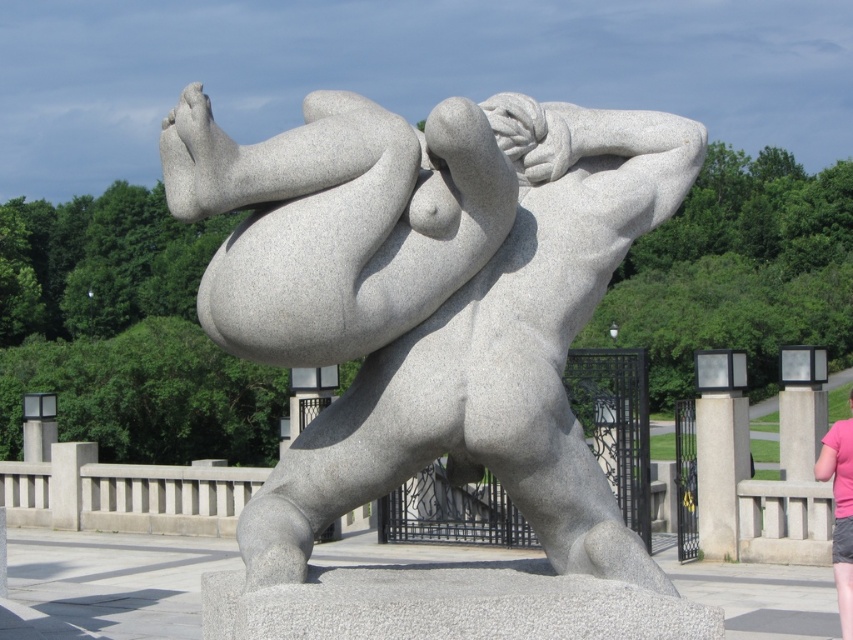
You are standing in a park and see the granite statue at center. If you want to take a photo of it from a distance that is exactly 25 feet away, would you need to move closer or farther away?

The granite statue at center is currently 30.09 feet away from you. To take a photo from exactly 25 feet away, you would need to move closer to the statue by approximately 5.09 feet.

You are a visitor at an art exhibition and see the granite statue at center and the pink fabric at lower right. According to the scene, which object is positioned to the right side?

The pink fabric at lower right is positioned to the right of the granite statue at center.

You are a photographer standing at the edge of the paved area. You want to take a photo of the granite statue at center and the pink fabric at lower right. Which object should you focus on first to ensure both are in sharp focus?

The granite statue at center is closer to the viewer than the pink fabric at lower right. To ensure both are in sharp focus, you should focus on the granite statue at center first, as it is closer, and the depth of field will naturally include the pink fabric at lower right in the background.